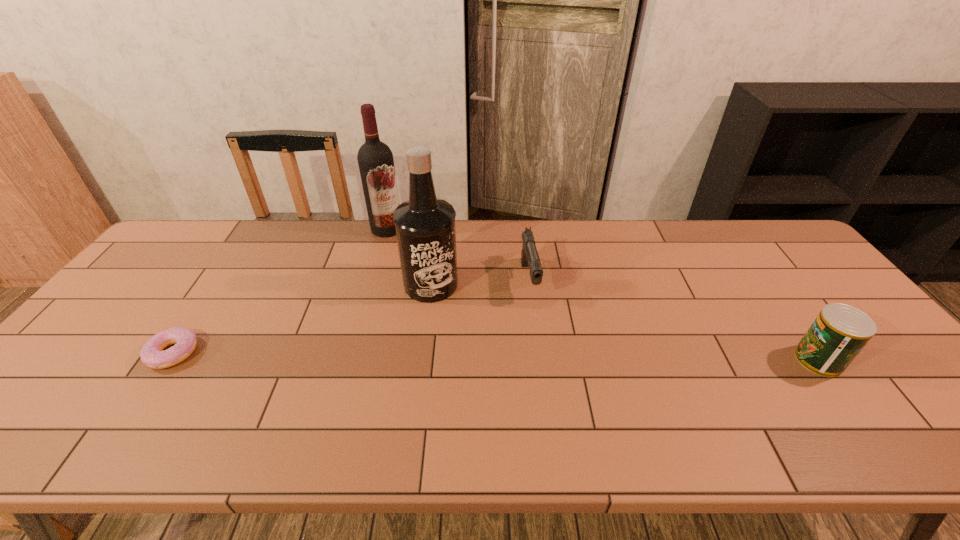
Where is `free spot on the desktop that is between the shortest object and the can and is positioned on the front label of the third object from left to right`? This screenshot has height=540, width=960. free spot on the desktop that is between the shortest object and the can and is positioned on the front label of the third object from left to right is located at coordinates (484, 356).

The height and width of the screenshot is (540, 960). Identify the location of vacant space on the desktop that is between the shortest object and the can and is positioned in the direction the gun is aimed. (547, 357).

Locate an element on the screen. This screenshot has height=540, width=960. vacant space on the desktop that is between the shortest object and the rightmost object and is positioned on the label of the farthest object is located at coordinates (406, 356).